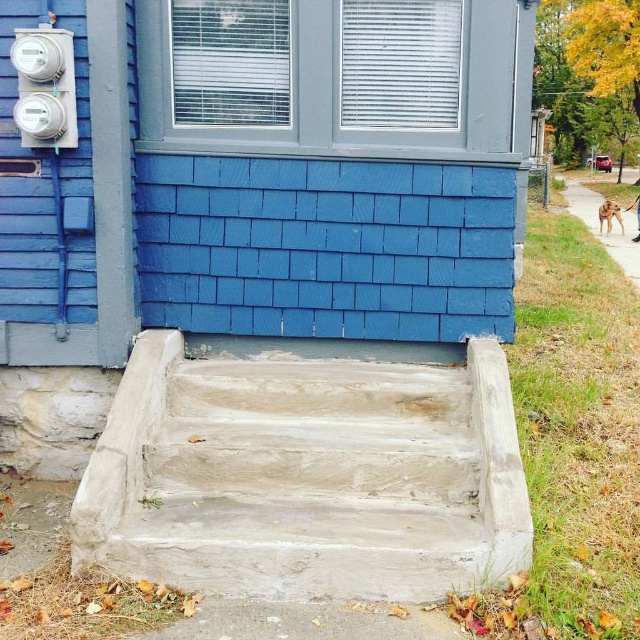
Question: Can you confirm if concrete stairs at center is thinner than blue shingles at center?

Choices:
 (A) yes
 (B) no

Answer: (B)

Question: Does concrete stairs at center appear under blue shingles at center?

Choices:
 (A) yes
 (B) no

Answer: (A)

Question: Among these points, which one is nearest to the camera?

Choices:
 (A) pos(486,406)
 (B) pos(243,196)

Answer: (A)

Question: Is concrete stairs at center bigger than blue shingles at center?

Choices:
 (A) no
 (B) yes

Answer: (B)